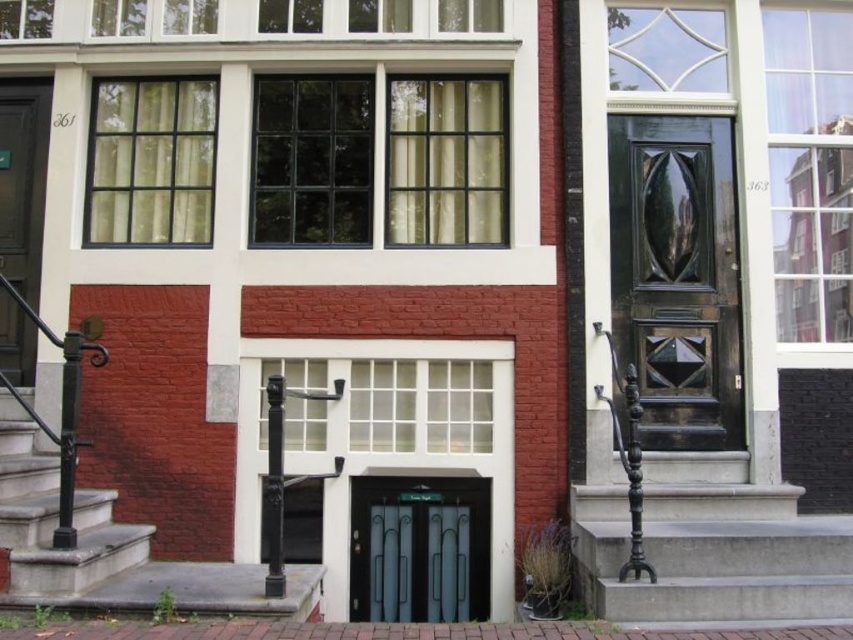
You are standing in front of a building with a white and red brick facade. There is a point marked at coordinate (419,548). What object is located at this coordinate?

The point at coordinate (419,548) indicates a metallic gray door at center.

You are standing in front of the building and want to enter through one of the doors. Which door is easier to approach first, the glossy wood door at right or the matte black door at left?

The glossy wood door at right is closer to the viewer than the matte black door at left, so it is easier to approach first.